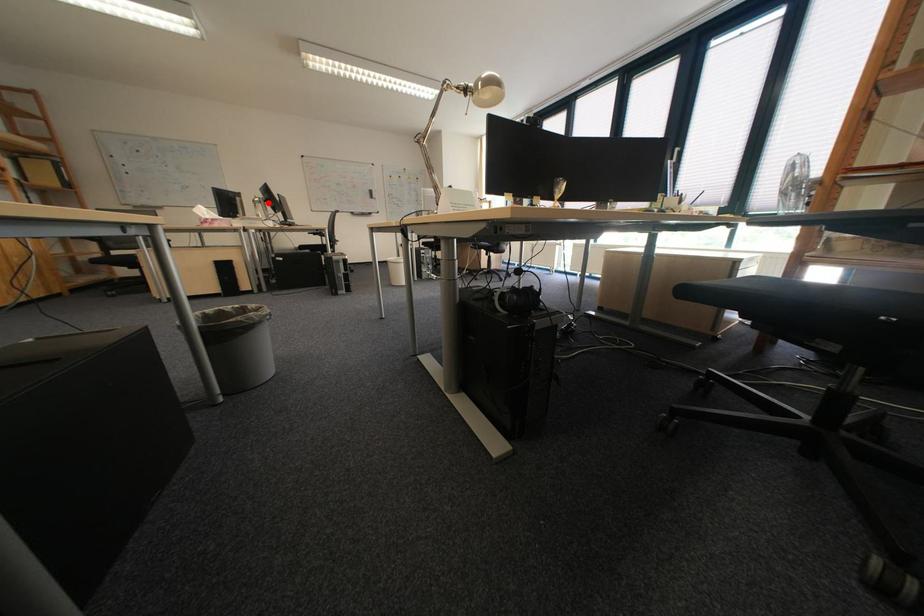
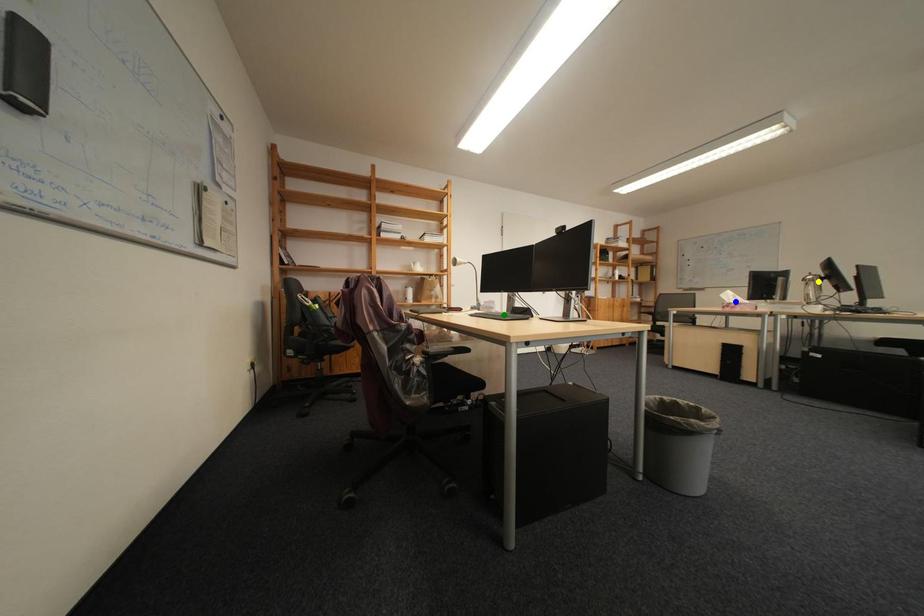
Question: I am providing you with two images of the same scene from different viewpoints. A red point is marked on the first image. You are given multiple points on the second image. Which spot in image 2 lines up with the point in image 1?

Choices:
 (A) green point
 (B) blue point
 (C) yellow point

Answer: (C)